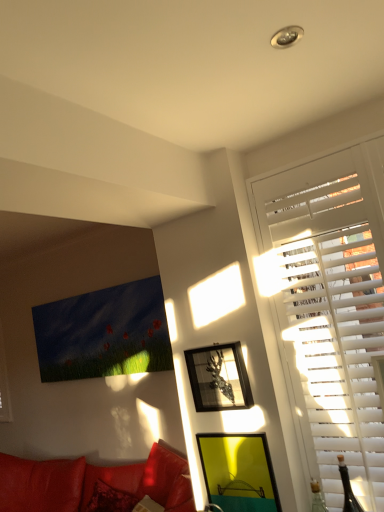
Question: Is white wood blinds at right to the right of yellow matte picture frame at lower center, the second picture frame when ordered from top to bottom, from the viewer's perspective?

Choices:
 (A) yes
 (B) no

Answer: (A)

Question: Considering the relative sizes of white wood blinds at right and yellow matte picture frame at lower center, the first picture frame from the bottom, in the image provided, is white wood blinds at right thinner than yellow matte picture frame at lower center, the first picture frame from the bottom,?

Choices:
 (A) yes
 (B) no

Answer: (B)

Question: Are white wood blinds at right and yellow matte picture frame at lower center, the second picture frame when ordered from top to bottom, making contact?

Choices:
 (A) no
 (B) yes

Answer: (A)

Question: Does white wood blinds at right come in front of yellow matte picture frame at lower center, the second picture frame when ordered from top to bottom?

Choices:
 (A) yes
 (B) no

Answer: (A)

Question: Considering the relative sizes of white wood blinds at right and yellow matte picture frame at lower center, the second picture frame when ordered from top to bottom, in the image provided, is white wood blinds at right wider than yellow matte picture frame at lower center, the second picture frame when ordered from top to bottom,?

Choices:
 (A) yes
 (B) no

Answer: (A)

Question: From the image's perspective, is white wood blinds at right above yellow matte picture frame at lower center, the second picture frame when ordered from top to bottom?

Choices:
 (A) yes
 (B) no

Answer: (A)

Question: From a real-world perspective, is yellow matte picture frame at lower center, the first picture frame from the bottom, on white wood blinds at right?

Choices:
 (A) yes
 (B) no

Answer: (B)

Question: Is white wood blinds at right at the back of yellow matte picture frame at lower center, the first picture frame from the bottom?

Choices:
 (A) no
 (B) yes

Answer: (A)

Question: Is white wood blinds at right completely or partially inside yellow matte picture frame at lower center, the first picture frame from the bottom?

Choices:
 (A) no
 (B) yes

Answer: (A)

Question: Considering the relative sizes of yellow matte picture frame at lower center, the second picture frame when ordered from top to bottom, and white wood blinds at right in the image provided, is yellow matte picture frame at lower center, the second picture frame when ordered from top to bottom, wider than white wood blinds at right?

Choices:
 (A) yes
 (B) no

Answer: (B)

Question: From the image's perspective, is yellow matte picture frame at lower center, the first picture frame from the bottom, under white wood blinds at right?

Choices:
 (A) yes
 (B) no

Answer: (A)

Question: Can you confirm if yellow matte picture frame at lower center, the second picture frame when ordered from top to bottom, is smaller than white wood blinds at right?

Choices:
 (A) yes
 (B) no

Answer: (A)

Question: From a real-world perspective, is yellow matte picture frame at lower center, the second picture frame when ordered from top to bottom, physically below metallic silver picture frame at upper right, the first picture frame viewed from the top?

Choices:
 (A) yes
 (B) no

Answer: (A)